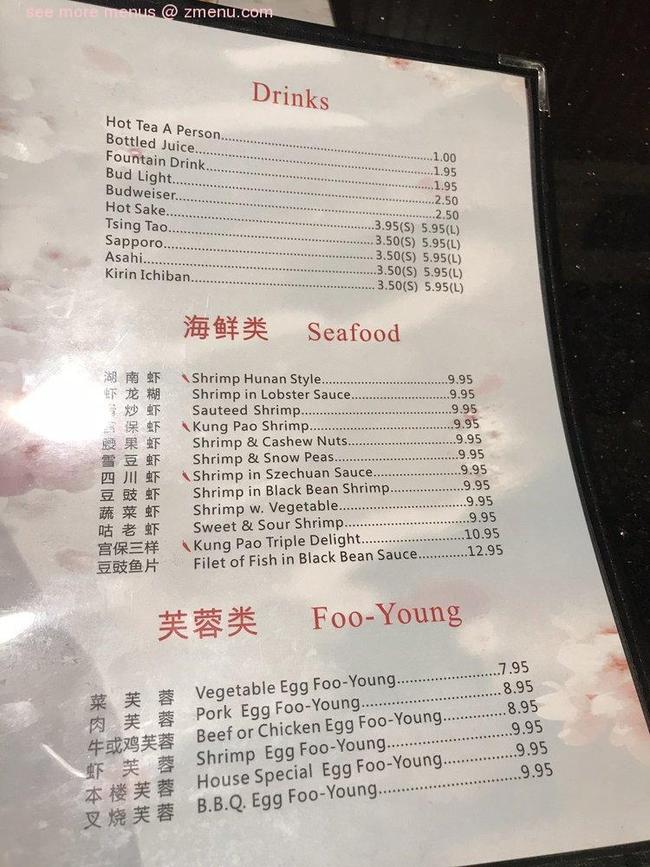
This screenshot has height=867, width=650. In order to click on black restaurant menu cover in this screenshot , I will do `click(439, 48)`.